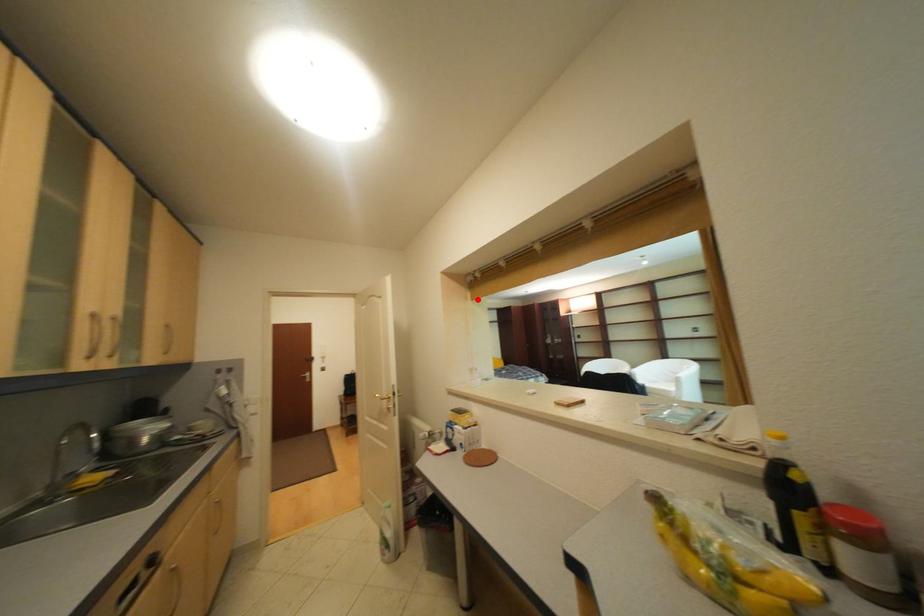
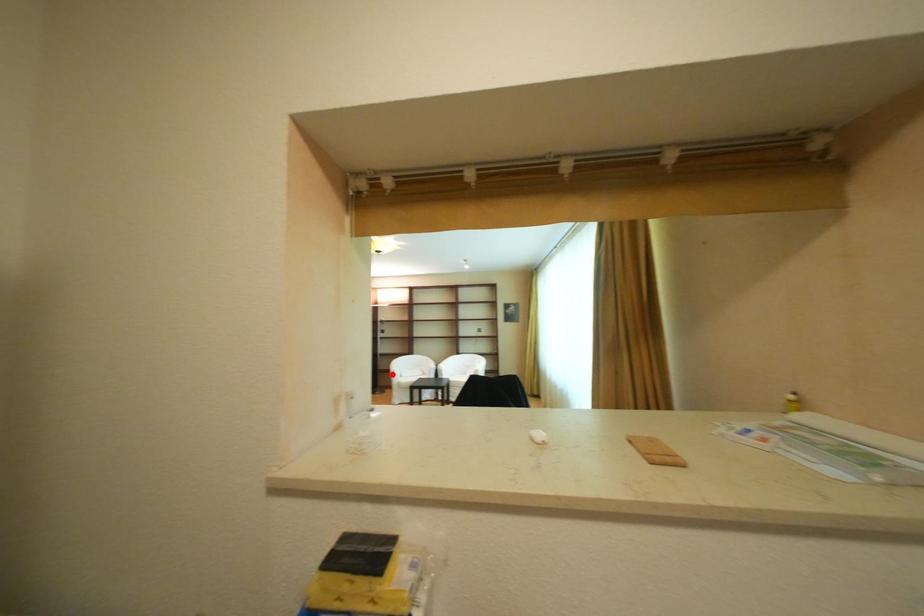
I am providing you with two images of the same scene from different viewpoints. A red point is marked on the first image and another point is marked on the second image. Does the point marked in image1 correspond to the same location as the one in image2?

No